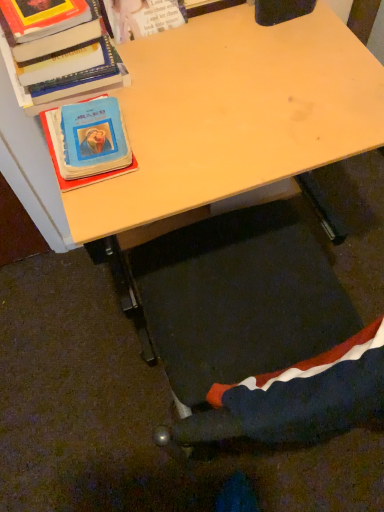
The image size is (384, 512). What do you see at coordinates (60, 61) in the screenshot?
I see `hardcover book at upper left, arranged as the first book when viewed from the top` at bounding box center [60, 61].

This screenshot has height=512, width=384. I want to click on hardcover book at upper left, arranged as the first book when viewed from the top, so click(60, 61).

You are a GUI agent. You are given a task and a screenshot of the screen. Output one action in this format:
    pyautogui.click(x=<x>, y=<y>)
    Task: Click on the blue matte book at left, arranged as the 2th book when viewed from the top
    This screenshot has height=512, width=384.
    Given the screenshot: What is the action you would take?
    pyautogui.click(x=83, y=177)

Where is `velvet-like fabric swivel chair at lower center`? velvet-like fabric swivel chair at lower center is located at coordinates (292, 399).

Locate an element on the screen. Image resolution: width=384 pixels, height=512 pixels. hardcover book at upper left, which is the second book in bottom-to-top order is located at coordinates (60, 61).

Does blue matte book at left, arranged as the 2th book when viewed from the top, contain hardcover book at upper left, arranged as the first book when viewed from the top?

No, hardcover book at upper left, arranged as the first book when viewed from the top, is located outside of blue matte book at left, arranged as the 2th book when viewed from the top.

Does blue matte book at left, arranged as the 2th book when viewed from the top, appear on the left side of hardcover book at upper left, arranged as the first book when viewed from the top?

In fact, blue matte book at left, arranged as the 2th book when viewed from the top, is to the right of hardcover book at upper left, arranged as the first book when viewed from the top.

Measure the distance from blue matte book at left, arranged as the 2th book when viewed from the top, to hardcover book at upper left, which is the second book in bottom-to-top order.

blue matte book at left, arranged as the 2th book when viewed from the top, and hardcover book at upper left, which is the second book in bottom-to-top order, are 8.98 centimeters apart from each other.

Based on the photo, can you confirm if blue matte book at left, arranged as the 2th book when viewed from the top, is thinner than hardcover book at upper left, which is the second book in bottom-to-top order?

Indeed, blue matte book at left, arranged as the 2th book when viewed from the top, has a lesser width compared to hardcover book at upper left, which is the second book in bottom-to-top order.

Is velvet-like fabric swivel chair at lower center further to the viewer compared to blue matte book at left, arranged as the 2th book when viewed from the top?

No, the depth of velvet-like fabric swivel chair at lower center is less than that of blue matte book at left, arranged as the 2th book when viewed from the top.

Is velvet-like fabric swivel chair at lower center far away from blue matte book at left, the first book when ordered from bottom to top?

They are positioned close to each other.

Which of these two, velvet-like fabric swivel chair at lower center or blue matte book at left, the first book when ordered from bottom to top, stands taller?

velvet-like fabric swivel chair at lower center.

Which of these two, velvet-like fabric swivel chair at lower center or blue matte book at left, arranged as the 2th book when viewed from the top, is thinner?

velvet-like fabric swivel chair at lower center.

Identify the location of swivel chair located below the wooden desk at center (from the image's perspective). The width and height of the screenshot is (384, 512). (292, 399).

How many degrees apart are the facing directions of velvet-like fabric swivel chair at lower center and wooden desk at center?

The angle between the facing direction of velvet-like fabric swivel chair at lower center and the facing direction of wooden desk at center is 180 degrees.

Between point (191, 429) and point (183, 72), which one is positioned in front?

The point (191, 429) is in front.

Which object is positioned more to the left, velvet-like fabric swivel chair at lower center or wooden desk at center?

Positioned to the left is wooden desk at center.

Who is more distant, wooden desk at center or hardcover book at upper left, which is the second book in bottom-to-top order?

Positioned behind is hardcover book at upper left, which is the second book in bottom-to-top order.

From a real-world perspective, is wooden desk at center positioned under hardcover book at upper left, arranged as the first book when viewed from the top, based on gravity?

Yes.

From the image's perspective, is wooden desk at center on top of hardcover book at upper left, which is the second book in bottom-to-top order?

No, from the image's perspective, wooden desk at center is not on top of hardcover book at upper left, which is the second book in bottom-to-top order.

Does velvet-like fabric swivel chair at lower center turn towards hardcover book at upper left, which is the second book in bottom-to-top order?

Yes, velvet-like fabric swivel chair at lower center is aimed at hardcover book at upper left, which is the second book in bottom-to-top order.

In the image, is velvet-like fabric swivel chair at lower center on the left side or the right side of hardcover book at upper left, which is the second book in bottom-to-top order?

velvet-like fabric swivel chair at lower center is positioned on hardcover book at upper left, which is the second book in bottom-to-top order,'s right side.

Based on their sizes in the image, would you say velvet-like fabric swivel chair at lower center is bigger or smaller than hardcover book at upper left, arranged as the first book when viewed from the top?

velvet-like fabric swivel chair at lower center is bigger than hardcover book at upper left, arranged as the first book when viewed from the top.

From the image's perspective, which one is positioned lower, blue matte book at left, the first book when ordered from bottom to top, or velvet-like fabric swivel chair at lower center?

velvet-like fabric swivel chair at lower center appears lower in the image.

Between blue matte book at left, the first book when ordered from bottom to top, and velvet-like fabric swivel chair at lower center, which one has smaller size?

blue matte book at left, the first book when ordered from bottom to top, is smaller.

In the scene shown: Considering the relative sizes of blue matte book at left, arranged as the 2th book when viewed from the top, and velvet-like fabric swivel chair at lower center in the image provided, is blue matte book at left, arranged as the 2th book when viewed from the top, shorter than velvet-like fabric swivel chair at lower center?

Correct, blue matte book at left, arranged as the 2th book when viewed from the top, is not as tall as velvet-like fabric swivel chair at lower center.

From a real-world perspective, is blue matte book at left, arranged as the 2th book when viewed from the top, physically below velvet-like fabric swivel chair at lower center?

No.

From the image's perspective, is blue matte book at left, the first book when ordered from bottom to top, on wooden desk at center?

Yes, from the image's perspective, blue matte book at left, the first book when ordered from bottom to top, is on top of wooden desk at center.

Consider the image. How distant is blue matte book at left, arranged as the 2th book when viewed from the top, from wooden desk at center?

blue matte book at left, arranged as the 2th book when viewed from the top, and wooden desk at center are 8.12 inches apart.

Is blue matte book at left, the first book when ordered from bottom to top, to the left of wooden desk at center from the viewer's perspective?

Correct, you'll find blue matte book at left, the first book when ordered from bottom to top, to the left of wooden desk at center.

Does blue matte book at left, arranged as the 2th book when viewed from the top, have a greater width compared to wooden desk at center?

In fact, blue matte book at left, arranged as the 2th book when viewed from the top, might be narrower than wooden desk at center.

There is a blue matte book at left, the first book when ordered from bottom to top. Where is `book above it (from a real-world perspective)`? book above it (from a real-world perspective) is located at coordinates [60, 61].

Locate an element on the screen. swivel chair below the blue matte book at left, the first book when ordered from bottom to top (from the image's perspective) is located at coordinates (292, 399).

Considering their positions, is velvet-like fabric swivel chair at lower center positioned further to hardcover book at upper left, which is the second book in bottom-to-top order, than blue matte book at left, the first book when ordered from bottom to top?

velvet-like fabric swivel chair at lower center is positioned further to the anchor hardcover book at upper left, which is the second book in bottom-to-top order.

Estimate the real-world distances between objects in this image. Which object is further from blue matte book at left, arranged as the 2th book when viewed from the top, hardcover book at upper left, arranged as the first book when viewed from the top, or wooden desk at center?

Based on the image, wooden desk at center appears to be further to blue matte book at left, arranged as the 2th book when viewed from the top.

Based on their spatial positions, is blue matte book at left, the first book when ordered from bottom to top, or hardcover book at upper left, arranged as the first book when viewed from the top, further from wooden desk at center?

Among the two, blue matte book at left, the first book when ordered from bottom to top, is located further to wooden desk at center.

Looking at the image, which one is located further to hardcover book at upper left, which is the second book in bottom-to-top order, wooden desk at center or velvet-like fabric swivel chair at lower center?

velvet-like fabric swivel chair at lower center is further to hardcover book at upper left, which is the second book in bottom-to-top order.

When comparing their distances from velvet-like fabric swivel chair at lower center, does wooden desk at center or blue matte book at left, the first book when ordered from bottom to top, seem further?

The object further to velvet-like fabric swivel chair at lower center is blue matte book at left, the first book when ordered from bottom to top.

From the image, which object appears to be nearer to hardcover book at upper left, arranged as the first book when viewed from the top, blue matte book at left, arranged as the 2th book when viewed from the top, or wooden desk at center?

blue matte book at left, arranged as the 2th book when viewed from the top.

When comparing their distances from blue matte book at left, arranged as the 2th book when viewed from the top, does wooden desk at center or hardcover book at upper left, arranged as the first book when viewed from the top, seem closer?

The object closer to blue matte book at left, arranged as the 2th book when viewed from the top, is hardcover book at upper left, arranged as the first book when viewed from the top.

From the image, which object appears to be farther from blue matte book at left, the first book when ordered from bottom to top, velvet-like fabric swivel chair at lower center or hardcover book at upper left, which is the second book in bottom-to-top order?

velvet-like fabric swivel chair at lower center is further to blue matte book at left, the first book when ordered from bottom to top.

I want to click on book that lies between hardcover book at upper left, arranged as the first book when viewed from the top, and velvet-like fabric swivel chair at lower center from top to bottom, so click(83, 177).

This screenshot has width=384, height=512. Find the location of `book between hardcover book at upper left, which is the second book in bottom-to-top order, and wooden desk at center, in the horizontal direction`. book between hardcover book at upper left, which is the second book in bottom-to-top order, and wooden desk at center, in the horizontal direction is located at coordinates (83, 177).

In order to click on desk between hardcover book at upper left, which is the second book in bottom-to-top order, and velvet-like fabric swivel chair at lower center in the up-down direction in this screenshot , I will do `click(208, 121)`.

Where is `desk between blue matte book at left, the first book when ordered from bottom to top, and velvet-like fabric swivel chair at lower center in the up-down direction`? desk between blue matte book at left, the first book when ordered from bottom to top, and velvet-like fabric swivel chair at lower center in the up-down direction is located at coordinates (208, 121).